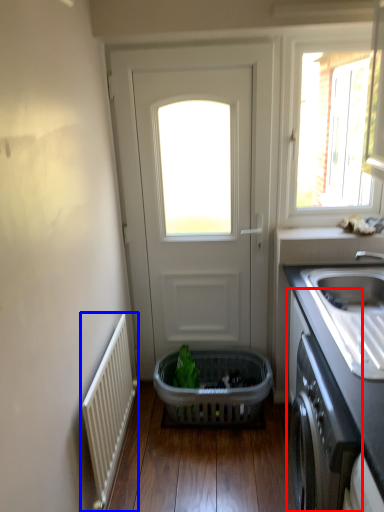
Question: Which point is closer to the camera, cabinetry (highlighted by a red box) or radiator (highlighted by a blue box)?

Choices:
 (A) cabinetry
 (B) radiator

Answer: (A)